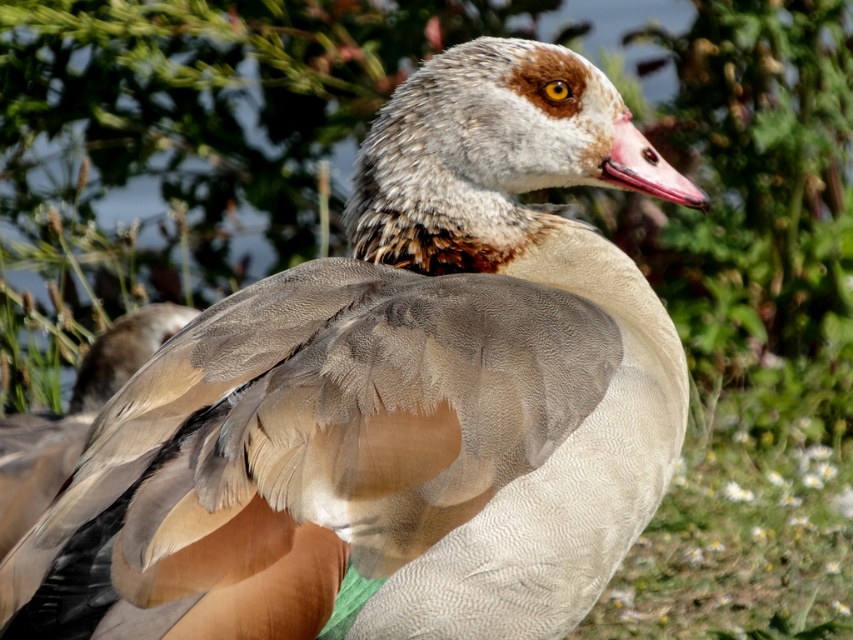
You are a wildlife photographer aiming to capture a closeup shot of the brown feathered wing at center. Your camera has a minimum focusing distance of 8 feet. Can you take the photo without moving closer?

The brown feathered wing at center is 8.15 feet away from camera. Since the minimum focusing distance is 8 feet, the camera can focus on the wing as the distance is slightly beyond the minimum requirement.

You are standing in front of the goose and notice two points marked on its body. The first point is at coordinate point (25, 433) and the second is at point (605, 168). Which point is closer to you?

Point (25, 433) is closer to you because it is further to the viewer than point (605, 168).